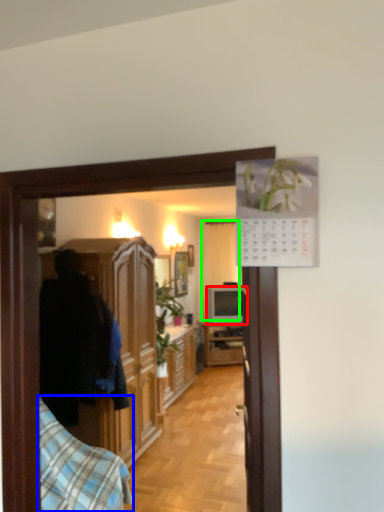
Question: Considering the real-world distances, which object is farthest from television (highlighted by a red box)? bedding (highlighted by a blue box) or curtain (highlighted by a green box)?

Choices:
 (A) bedding
 (B) curtain

Answer: (A)